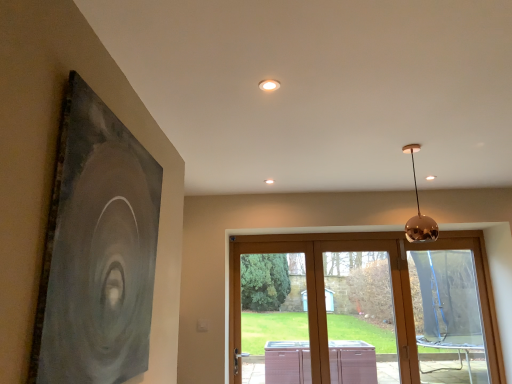
Question: Considering the relative positions of matte black painting at left and wooden sliding door at center, arranged as the second window when viewed from the left, in the image provided, is matte black painting at left behind wooden sliding door at center, arranged as the second window when viewed from the left,?

Choices:
 (A) no
 (B) yes

Answer: (A)

Question: Is matte black painting at left closer to camera compared to wooden sliding door at center, arranged as the second window when viewed from the left?

Choices:
 (A) yes
 (B) no

Answer: (A)

Question: Does matte black painting at left have a lesser width compared to wooden sliding door at center, acting as the second window starting from the right?

Choices:
 (A) no
 (B) yes

Answer: (B)

Question: Is matte black painting at left facing away from wooden sliding door at center, acting as the second window starting from the right?

Choices:
 (A) no
 (B) yes

Answer: (A)

Question: Is matte black painting at left wider than wooden sliding door at center, arranged as the second window when viewed from the left?

Choices:
 (A) no
 (B) yes

Answer: (A)

Question: From a real-world perspective, is matte black painting at left over wooden sliding door at center, arranged as the second window when viewed from the left?

Choices:
 (A) yes
 (B) no

Answer: (A)

Question: Can you confirm if clear glass door at center, the 1th window in the left-to-right sequence, is shorter than matte black painting at left?

Choices:
 (A) no
 (B) yes

Answer: (A)

Question: From a real-world perspective, is clear glass door at center, the 1th window in the left-to-right sequence, under matte black painting at left?

Choices:
 (A) no
 (B) yes

Answer: (B)

Question: Is clear glass door at center, the third window when ordered from right to left, located outside matte black painting at left?

Choices:
 (A) yes
 (B) no

Answer: (A)

Question: Is clear glass door at center, the third window when ordered from right to left, to the left of matte black painting at left from the viewer's perspective?

Choices:
 (A) yes
 (B) no

Answer: (B)

Question: From a real-world perspective, is clear glass door at center, the 1th window in the left-to-right sequence, over matte black painting at left?

Choices:
 (A) no
 (B) yes

Answer: (A)

Question: Does clear glass door at center, the third window when ordered from right to left, have a lesser width compared to matte black painting at left?

Choices:
 (A) no
 (B) yes

Answer: (A)

Question: Considering the relative positions of wooden sliding door at center, arranged as the second window when viewed from the left, and transparent plastic window at lower right, which appears as the 1th window when viewed from the right, in the image provided, is wooden sliding door at center, arranged as the second window when viewed from the left, to the right of transparent plastic window at lower right, which appears as the 1th window when viewed from the right, from the viewer's perspective?

Choices:
 (A) yes
 (B) no

Answer: (B)